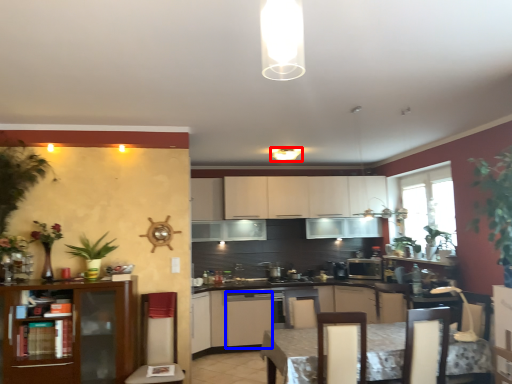
Question: Which point is closer to the camera, lighting (highlighted by a red box) or cabinetry (highlighted by a blue box)?

Choices:
 (A) lighting
 (B) cabinetry

Answer: (A)